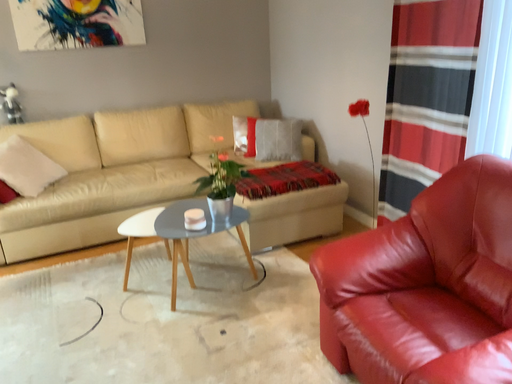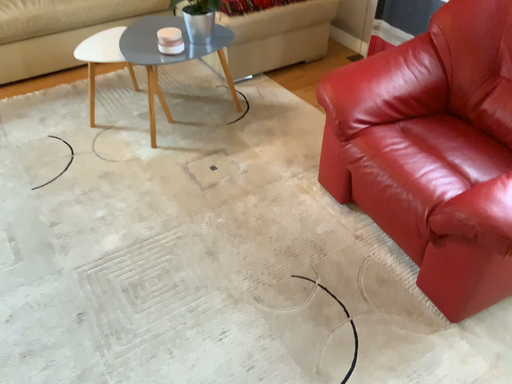
Question: Which way did the camera rotate in the video?

Choices:
 (A) rotated downward
 (B) rotated upward

Answer: (A)